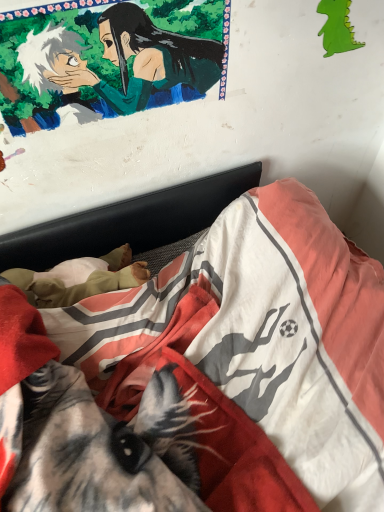
Question: Does green paper dragon at upper right turn towards smooth green fabric at upper left?

Choices:
 (A) yes
 (B) no

Answer: (B)

Question: Is green paper dragon at upper right taller than smooth green fabric at upper left?

Choices:
 (A) no
 (B) yes

Answer: (A)

Question: Can you confirm if green paper dragon at upper right is wider than smooth green fabric at upper left?

Choices:
 (A) yes
 (B) no

Answer: (B)

Question: Considering the relative sizes of green paper dragon at upper right and smooth green fabric at upper left in the image provided, is green paper dragon at upper right shorter than smooth green fabric at upper left?

Choices:
 (A) yes
 (B) no

Answer: (A)

Question: Considering the relative sizes of green paper dragon at upper right and smooth green fabric at upper left in the image provided, is green paper dragon at upper right smaller than smooth green fabric at upper left?

Choices:
 (A) no
 (B) yes

Answer: (B)

Question: Is green paper dragon at upper right surrounding smooth green fabric at upper left?

Choices:
 (A) yes
 (B) no

Answer: (B)

Question: Considering the relative sizes of smooth green fabric at upper left and soft cotton bed at center in the image provided, is smooth green fabric at upper left taller than soft cotton bed at center?

Choices:
 (A) yes
 (B) no

Answer: (B)

Question: Can you confirm if smooth green fabric at upper left is smaller than soft cotton bed at center?

Choices:
 (A) no
 (B) yes

Answer: (B)

Question: Is smooth green fabric at upper left not inside soft cotton bed at center?

Choices:
 (A) yes
 (B) no

Answer: (A)

Question: Is the depth of smooth green fabric at upper left less than that of soft cotton bed at center?

Choices:
 (A) yes
 (B) no

Answer: (B)

Question: From the image's perspective, is smooth green fabric at upper left on soft cotton bed at center?

Choices:
 (A) yes
 (B) no

Answer: (A)

Question: Is smooth green fabric at upper left shorter than soft cotton bed at center?

Choices:
 (A) no
 (B) yes

Answer: (B)

Question: Does smooth green fabric at upper left lie behind green paper dragon at upper right?

Choices:
 (A) yes
 (B) no

Answer: (B)